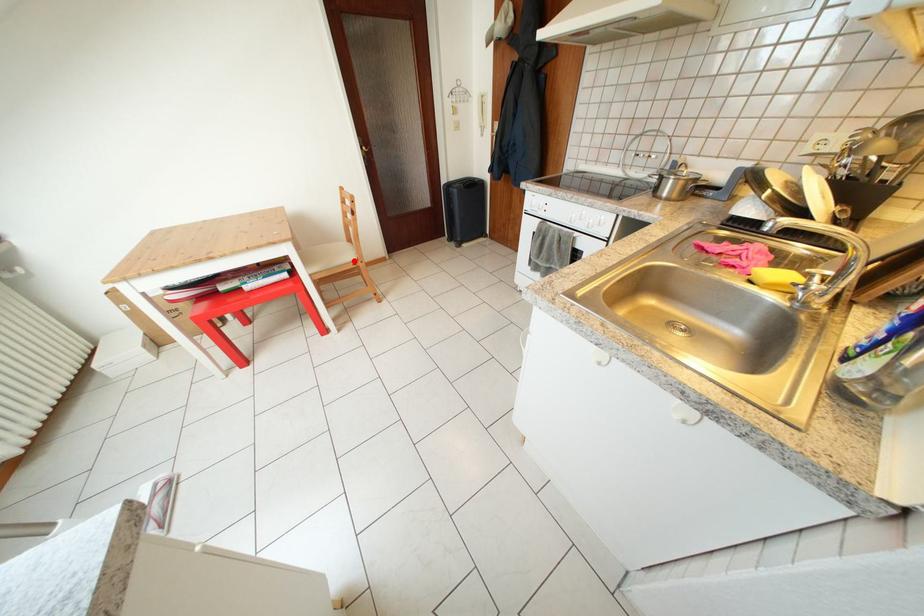
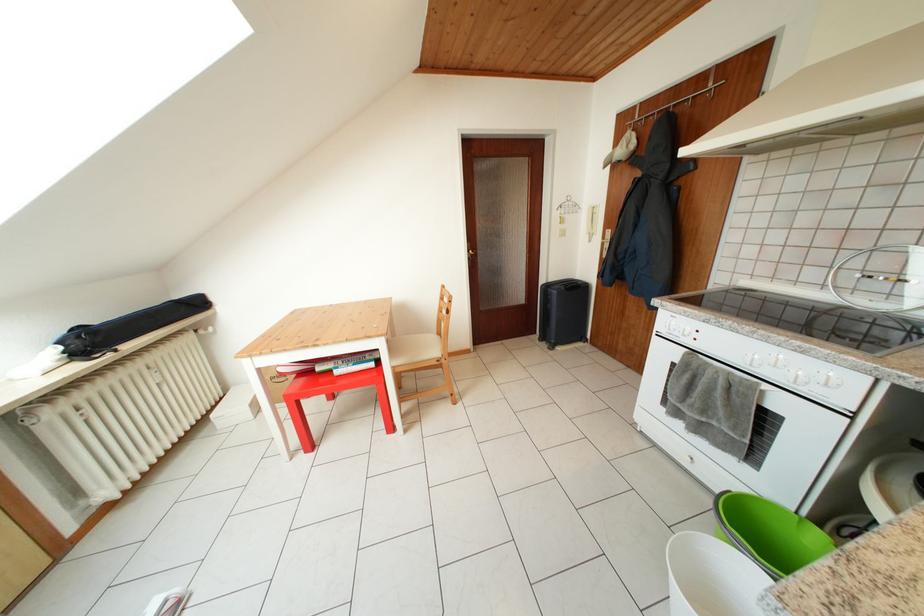
In the second image, find the point that corresponds to the highlighted location in the first image.

(440, 355)